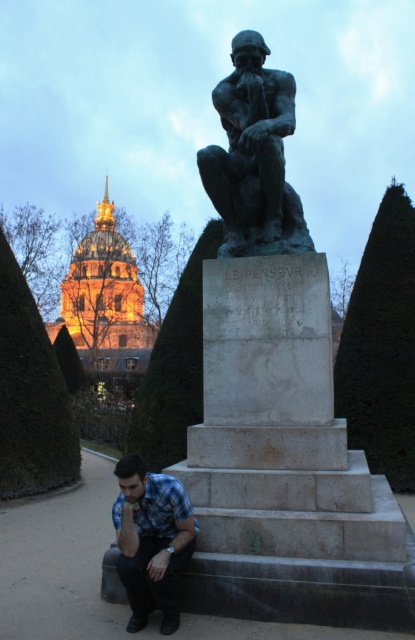
Does green leafy hedge at center have a lesser height compared to blue plaid shirt at lower left?

No, green leafy hedge at center is not shorter than blue plaid shirt at lower left.

Can you confirm if green leafy hedge at center is bigger than blue plaid shirt at lower left?

Indeed, green leafy hedge at center has a larger size compared to blue plaid shirt at lower left.

Find the location of `green leafy hedge at center`. green leafy hedge at center is located at coordinates (175, 368).

Which of these two, golden dome at upper left or blue plaid shirt at lower left, stands taller?

golden dome at upper left

Where is `golden dome at upper left`? The height and width of the screenshot is (640, 415). golden dome at upper left is located at coordinates (102, 308).

Does dark green hedge at right have a greater height compared to golden dome at upper left?

No.

Between dark green hedge at right and golden dome at upper left, which one has less height?

dark green hedge at right

Where is `dark green hedge at right`? The image size is (415, 640). dark green hedge at right is located at coordinates (381, 346).

At what (x,y) coordinates should I click in order to perform the action: click on dark green hedge at right. Please return your answer as a coordinate pair (x, y). The image size is (415, 640). Looking at the image, I should click on (381, 346).